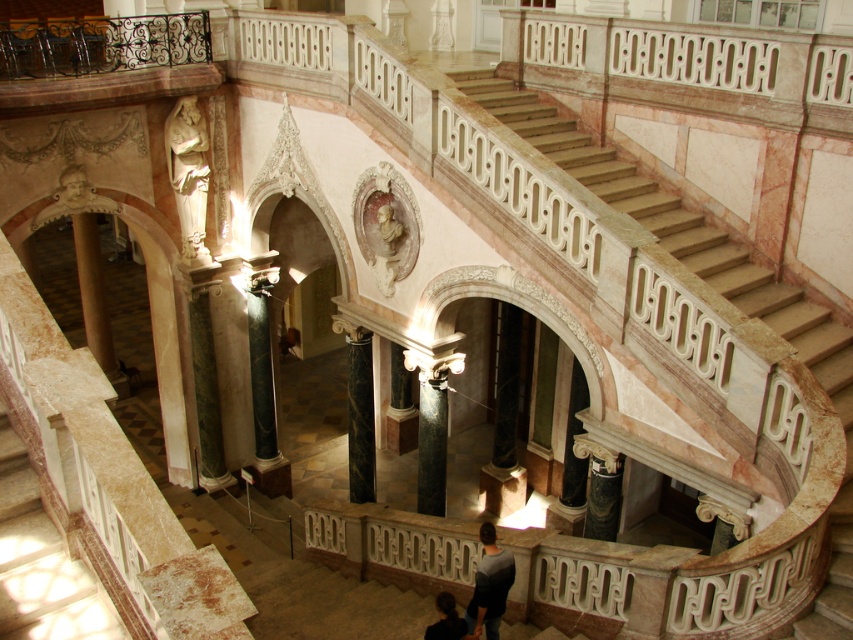
Between marble stairs at center and dark gray sweater at lower center, which one has less height?

With less height is dark gray sweater at lower center.

Which is more to the right, marble stairs at center or dark gray sweater at lower center?

Positioned to the right is marble stairs at center.

Identify the location of marble stairs at center. The height and width of the screenshot is (640, 853). (708, 284).

The height and width of the screenshot is (640, 853). I want to click on marble stairs at center, so click(708, 284).

Between marble stairs at center and white marble statue at upper center, which one has more height?

marble stairs at center is taller.

Does marble stairs at center have a lesser width compared to white marble statue at upper center?

No, marble stairs at center is not thinner than white marble statue at upper center.

Is point (468, 88) positioned behind point (166, 125)?

That is False.

This screenshot has width=853, height=640. Find the location of `marble stairs at center`. marble stairs at center is located at coordinates (708, 284).

Does green marble pillar at lower left have a lesser width compared to dark gray sweater at lower center?

No, green marble pillar at lower left is not thinner than dark gray sweater at lower center.

Can you confirm if green marble pillar at lower left is positioned to the right of dark gray sweater at lower center?

In fact, green marble pillar at lower left is to the left of dark gray sweater at lower center.

Locate an element on the screen. The image size is (853, 640). green marble pillar at lower left is located at coordinates 93,292.

The width and height of the screenshot is (853, 640). What are the coordinates of `green marble pillar at lower left` in the screenshot? It's located at (93, 292).